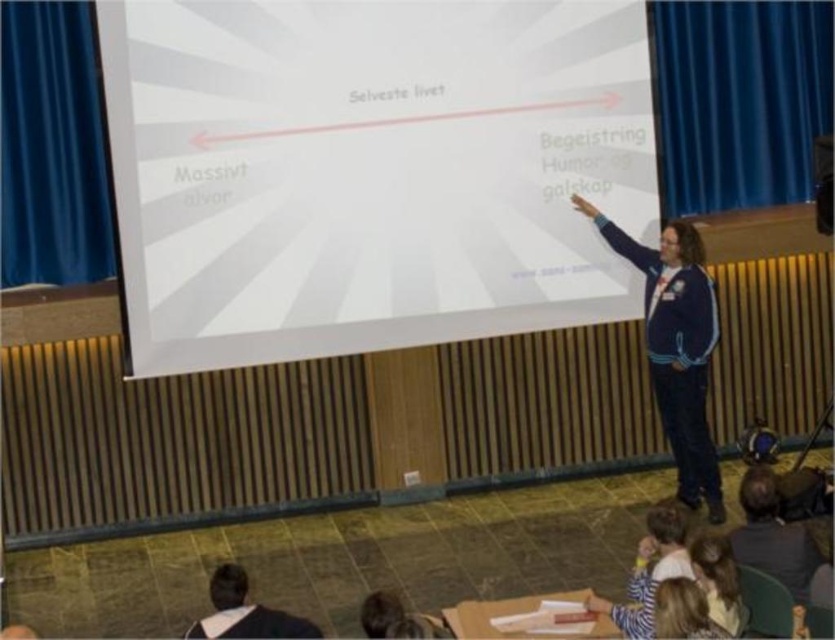
You are an attendee in the presentation and you want to take a photo of the presenter. The presenter is wearing a black fabric shirt at lower left and has light brown hair at lower right. Which object is wider so that it can be captured more clearly in your photo?

The black fabric shirt at lower left is wider than the light brown hair at lower right, so it can be captured more clearly in the photo.

In the scene shown: You are sitting in the front row of the lecture hall and see two points on the slide. Which point, point (709, 502) or point (722, 573), is closer to you?

Point (709, 502) is further to the camera than point (722, 573), so the point closer to you is point (722, 573).

You are attending a presentation in a lecture hall and notice two elements in the scene. One is the dark blue fleece jacket at right and the other is the light brown hair at lower right. Which of these is covering part of the other?

The dark blue fleece jacket at right is positioned over light brown hair at lower right, so it is covering part of it.